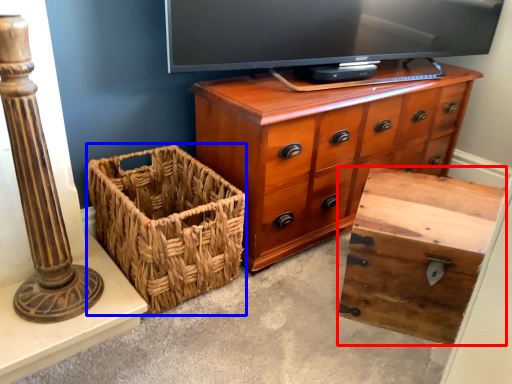
Question: Which of the following is the closest to the observer, storage box (highlighted by a red box) or basket (highlighted by a blue box)?

Choices:
 (A) storage box
 (B) basket

Answer: (A)